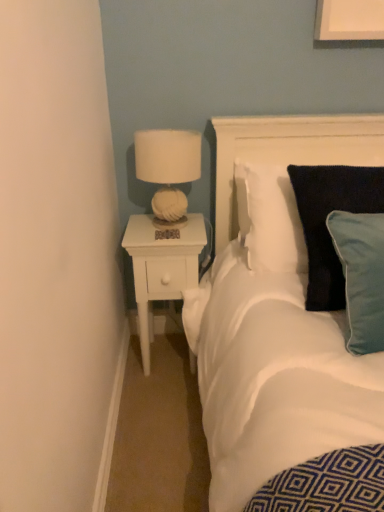
Question: From a real-world perspective, is white fabric headboard at upper right positioned under white fabric lampshade at upper right based on gravity?

Choices:
 (A) no
 (B) yes

Answer: (B)

Question: Can you confirm if white fabric headboard at upper right is taller than white fabric lampshade at upper right?

Choices:
 (A) no
 (B) yes

Answer: (B)

Question: From a real-world perspective, is white fabric headboard at upper right physically above white fabric lampshade at upper right?

Choices:
 (A) yes
 (B) no

Answer: (B)

Question: From the image's perspective, is white fabric headboard at upper right located above white fabric lampshade at upper right?

Choices:
 (A) yes
 (B) no

Answer: (B)

Question: Considering the relative sizes of white fabric headboard at upper right and white fabric lampshade at upper right in the image provided, is white fabric headboard at upper right thinner than white fabric lampshade at upper right?

Choices:
 (A) yes
 (B) no

Answer: (A)

Question: Is white fabric headboard at upper right far away from white fabric lampshade at upper right?

Choices:
 (A) no
 (B) yes

Answer: (A)

Question: From a real-world perspective, is white fabric lampshade at upper right positioned over white fabric headboard at upper right based on gravity?

Choices:
 (A) yes
 (B) no

Answer: (A)

Question: Is white fabric headboard at upper right at the back of white fabric lampshade at upper right?

Choices:
 (A) yes
 (B) no

Answer: (B)

Question: Is white fabric lampshade at upper right beside white fabric headboard at upper right?

Choices:
 (A) no
 (B) yes

Answer: (A)

Question: Is white fabric lampshade at upper right shorter than white fabric headboard at upper right?

Choices:
 (A) no
 (B) yes

Answer: (B)

Question: Is white fabric lampshade at upper right to the left of white fabric headboard at upper right from the viewer's perspective?

Choices:
 (A) yes
 (B) no

Answer: (A)

Question: Considering the relative positions of white fabric lampshade at upper right and white fabric headboard at upper right in the image provided, is white fabric lampshade at upper right to the right of white fabric headboard at upper right from the viewer's perspective?

Choices:
 (A) no
 (B) yes

Answer: (A)

Question: Is white wood nightstand at left placed right next to velvety dark blue pillow at right?

Choices:
 (A) yes
 (B) no

Answer: (B)